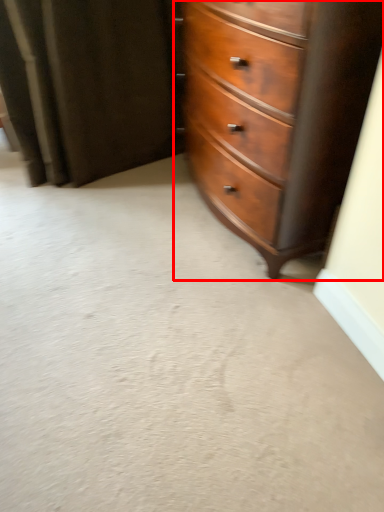
Question: Considering the relative positions of chest of drawers (annotated by the red box) and curtain in the image provided, where is chest of drawers (annotated by the red box) located with respect to the staircase?

Choices:
 (A) left
 (B) right

Answer: (B)